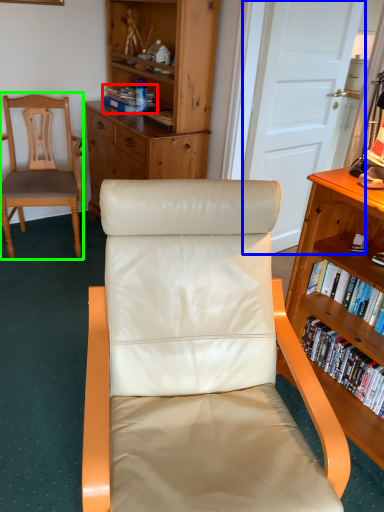
Question: Which object is positioned farthest from book (highlighted by a red box)? Select from door (highlighted by a blue box) and chair (highlighted by a green box).

Choices:
 (A) door
 (B) chair

Answer: (A)